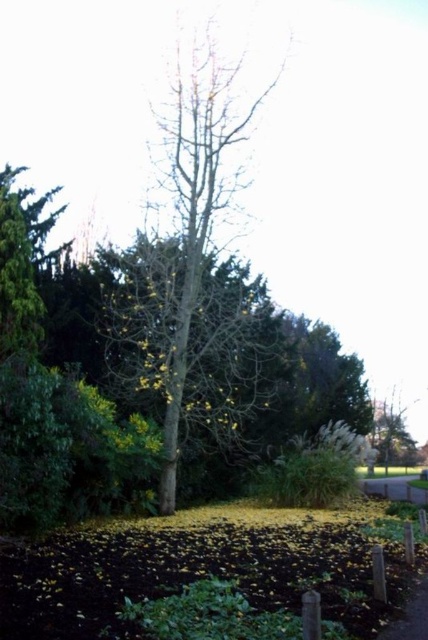
Looking at this image, which is below, yellow-green leafy tree at center or concrete pavement at lower right?

Positioned lower is concrete pavement at lower right.

Is point (195, 266) positioned after point (410, 496)?

That is False.

The image size is (428, 640). Find the location of `yellow-green leafy tree at center`. yellow-green leafy tree at center is located at coordinates (196, 202).